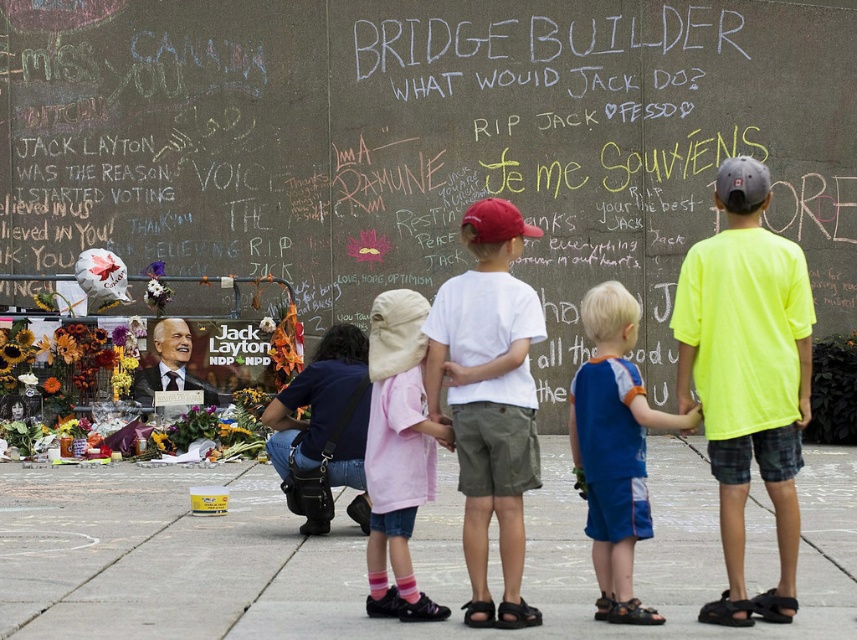
Question: Is pink fabric dress at center behind bright orange sunflower at lower left?

Choices:
 (A) yes
 (B) no

Answer: (B)

Question: Can you confirm if chalkboard at center is wider than neon yellow t-shirt at center?

Choices:
 (A) no
 (B) yes

Answer: (B)

Question: Which point is farther from the camera taking this photo?

Choices:
 (A) (565, 54)
 (B) (91, 385)
 (C) (372, 563)

Answer: (A)

Question: Can you confirm if chalkboard at center is positioned above blue cotton shorts at center?

Choices:
 (A) yes
 (B) no

Answer: (A)

Question: Which object appears farthest from the camera in this image?

Choices:
 (A) neon yellow t-shirt at center
 (B) gray concrete pavement at lower center
 (C) chalkboard at center
 (D) white cotton shirt at center

Answer: (C)

Question: Estimate the real-world distances between objects in this image. Which object is closer to the neon yellow t-shirt at center?

Choices:
 (A) chalkboard at center
 (B) blue cotton shorts at center
 (C) gray concrete pavement at lower center
 (D) bright orange sunflower at lower left

Answer: (B)